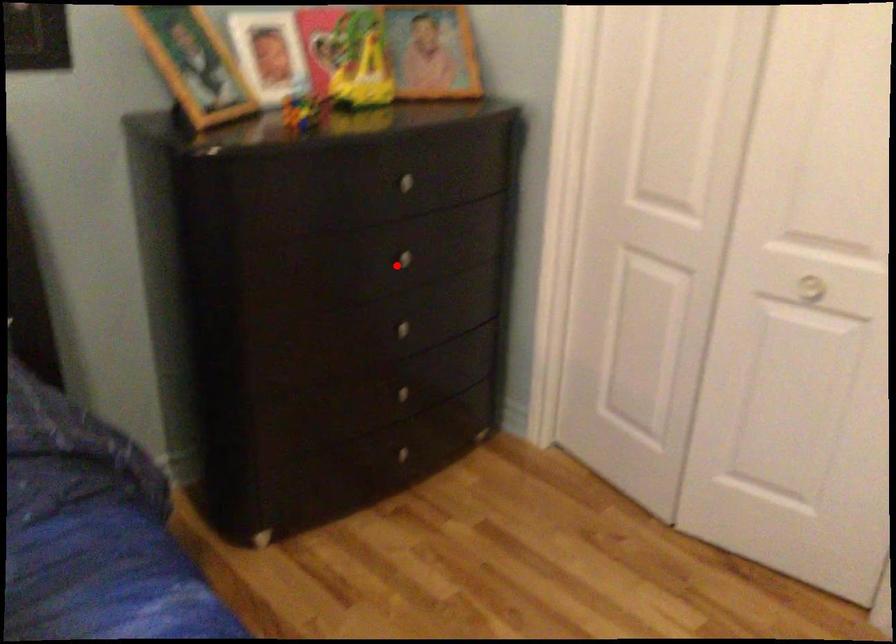
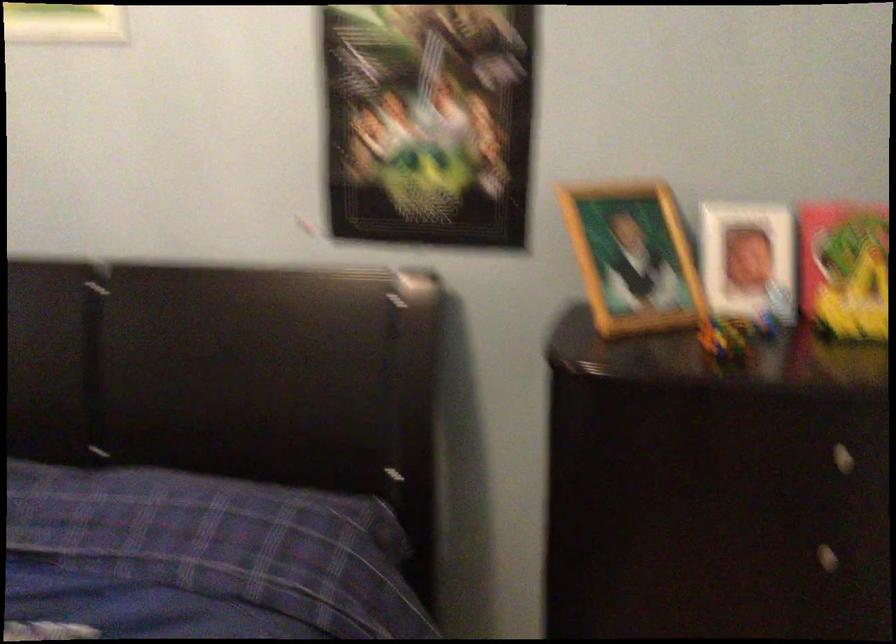
Where in the second image is the point corresponding to the highlighted location from the first image?

(807, 554)